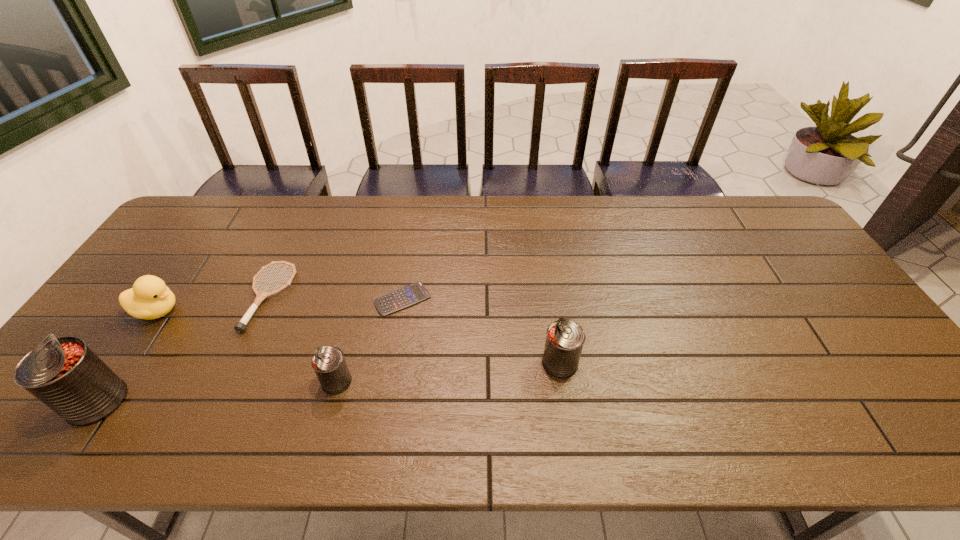
Locate an element on the screen. vacant space that's between the shortest can and the third object from left to right is located at coordinates (302, 339).

At what (x,y) coordinates should I click in order to perform the action: click on free space that is in between the fourth object from right to left and the second can from right to left. Please return your answer as a coordinate pair (x, y). This screenshot has height=540, width=960. Looking at the image, I should click on (302, 339).

Identify the location of blank region between the shortest can and the tennis racket. (302, 339).

The height and width of the screenshot is (540, 960). Find the location of `vacant region between the second can from left to right and the calculator`. vacant region between the second can from left to right and the calculator is located at coordinates (370, 340).

Where is `free space that is in between the leftmost can and the calculator`? The width and height of the screenshot is (960, 540). free space that is in between the leftmost can and the calculator is located at coordinates (250, 350).

The height and width of the screenshot is (540, 960). I want to click on free space between the tallest object and the second object from right to left, so click(250, 350).

Identify which object is the second closest to the rightmost can. Please provide its 2D coordinates. Your answer should be formatted as a tuple, i.e. [(x, y)], where the tuple contains the x and y coordinates of a point satisfying the conditions above.

[(329, 364)]

Identify the location of the second closest object to the tallest object. point(240,326).

Where is `can that stands as the closest to the fourth object from left to right`? This screenshot has height=540, width=960. can that stands as the closest to the fourth object from left to right is located at coordinates (64, 373).

Locate an element on the screen. The width and height of the screenshot is (960, 540). can identified as the closest to the duck is located at coordinates (64, 373).